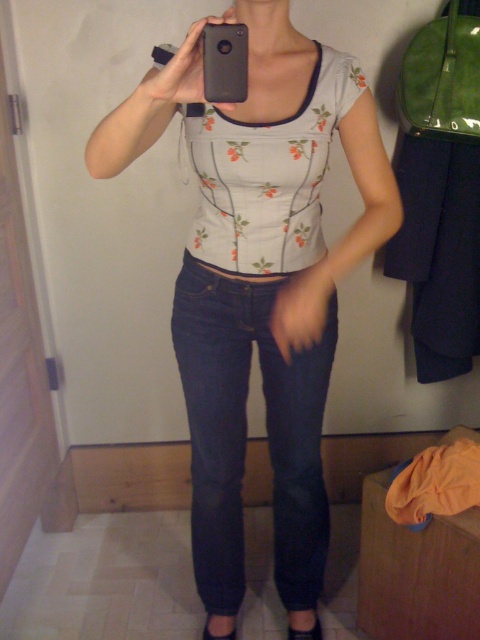
Is dark blue denim jeans at center to the right of black matte phone at upper center from the viewer's perspective?

Yes, dark blue denim jeans at center is to the right of black matte phone at upper center.

Can you confirm if dark blue denim jeans at center is wider than black matte phone at upper center?

Indeed, dark blue denim jeans at center has a greater width compared to black matte phone at upper center.

Between point (226, 513) and point (211, 42), which one is positioned in front?

Positioned in front is point (211, 42).

At what (x,y) coordinates should I click in order to perform the action: click on dark blue denim jeans at center. Please return your answer as a coordinate pair (x, y). Looking at the image, I should click on (245, 435).

In the scene shown: Can you confirm if denim jeans at center is positioned to the right of dark blue denim jeans at center?

Yes, denim jeans at center is to the right of dark blue denim jeans at center.

Who is higher up, denim jeans at center or dark blue denim jeans at center?

Positioned higher is denim jeans at center.

Which is behind, point (222, 608) or point (278, 396)?

The point (222, 608) is more distant.

Locate an element on the screen. denim jeans at center is located at coordinates (260, 282).

Does denim jeans at center lie behind black matte phone at upper center?

No.

Does point (304, 625) lie in front of point (206, 83)?

No.

Which is in front, point (289, 609) or point (242, 60)?

Positioned in front is point (242, 60).

Where is `denim jeans at center`? This screenshot has width=480, height=640. denim jeans at center is located at coordinates (260, 282).